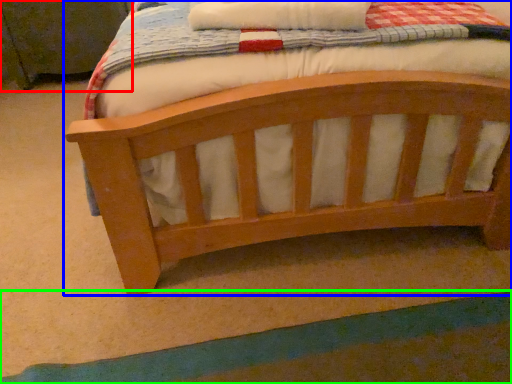
Question: Considering the real-world distances, which object is farthest from changing table (highlighted by a red box)? bed (highlighted by a blue box) or strip (highlighted by a green box)?

Choices:
 (A) bed
 (B) strip

Answer: (B)